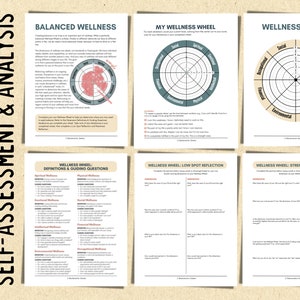
This screenshot has height=300, width=300. Find the location of `beige trim`. beige trim is located at coordinates (273, 50), (296, 119), (266, 104).